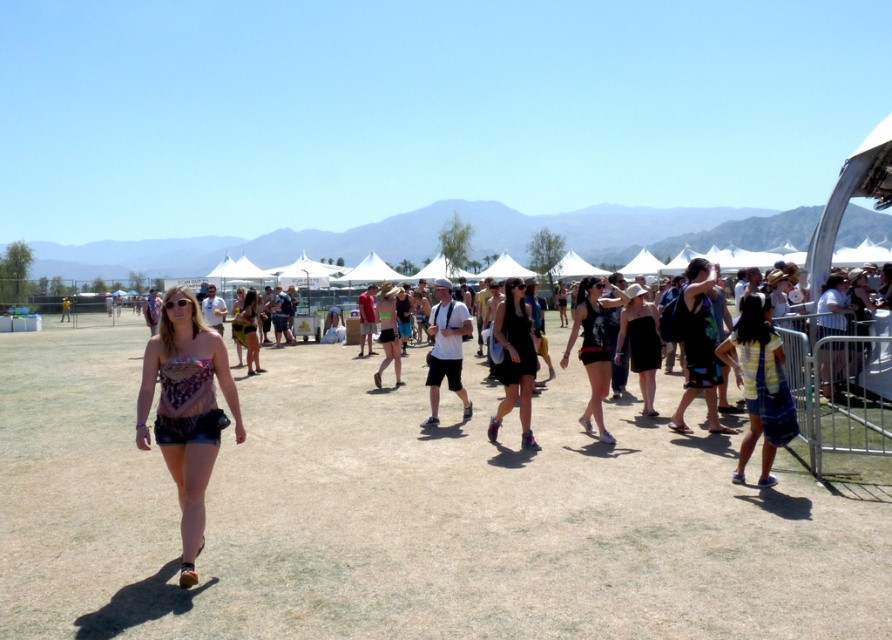
Can you confirm if white cotton t-shirt at center is positioned above matte brown dress at center?

Incorrect, white cotton t-shirt at center is not positioned above matte brown dress at center.

Between white cotton t-shirt at center and matte brown dress at center, which one has less height?

white cotton t-shirt at center

At what (x,y) coordinates should I click in order to perform the action: click on white cotton t-shirt at center. Please return your answer as a coordinate pair (x, y). The height and width of the screenshot is (640, 892). Looking at the image, I should click on (446, 348).

Which of these two, blue striped dress at right or black matte dress at center, stands shorter?

With less height is blue striped dress at right.

Measure the distance between blue striped dress at right and camera.

The distance of blue striped dress at right from camera is 6.35 meters.

I want to click on blue striped dress at right, so click(758, 385).

Locate an element on the screen. This screenshot has width=892, height=640. blue striped dress at right is located at coordinates (758, 385).

Can you confirm if denim shorts at center is bigger than matte black tank top at center?

Indeed, denim shorts at center has a larger size compared to matte black tank top at center.

Between point (196, 547) and point (601, 388), which one is positioned behind?

Point (601, 388)

Identify the location of denim shorts at center. (186, 410).